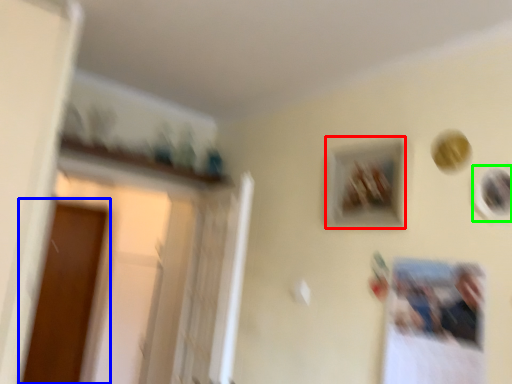
Question: Considering the real-world distances, which object is closest to picture frame (highlighted by a red box)? screen door (highlighted by a blue box) or picture frame (highlighted by a green box).

Choices:
 (A) screen door
 (B) picture frame

Answer: (B)